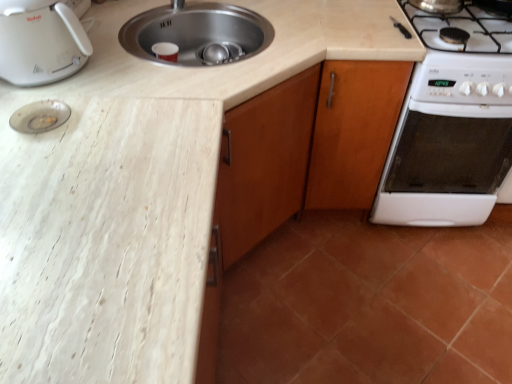
Where is `vacant area that is in front of white plastic toaster at upper left`? The width and height of the screenshot is (512, 384). vacant area that is in front of white plastic toaster at upper left is located at coordinates (57, 97).